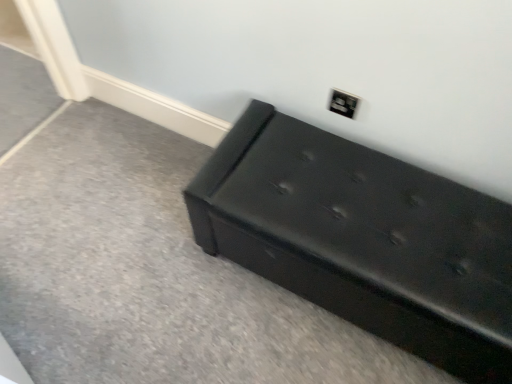
This screenshot has height=384, width=512. In order to click on vacant space positioned to the left of black leather bench at lower right in this screenshot , I will do `click(146, 264)`.